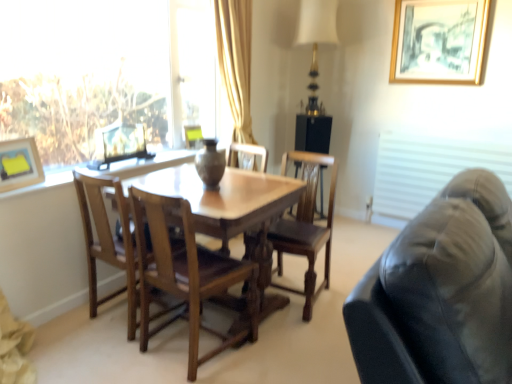
Image resolution: width=512 pixels, height=384 pixels. Identify the location of free space in front of wooden chair at center, placed as the third chair when sorted from left to right. (305, 334).